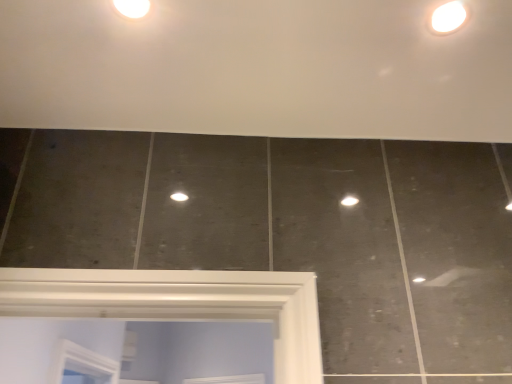
Question: Would you say white glossy droplight at upper left is outside white glossy light fixture at upper right?

Choices:
 (A) no
 (B) yes

Answer: (B)

Question: Considering the relative sizes of white glossy droplight at upper left and white glossy light fixture at upper right in the image provided, is white glossy droplight at upper left shorter than white glossy light fixture at upper right?

Choices:
 (A) yes
 (B) no

Answer: (A)

Question: Considering the relative sizes of white glossy droplight at upper left and white glossy light fixture at upper right in the image provided, is white glossy droplight at upper left taller than white glossy light fixture at upper right?

Choices:
 (A) no
 (B) yes

Answer: (A)

Question: From a real-world perspective, is white glossy droplight at upper left below white glossy light fixture at upper right?

Choices:
 (A) yes
 (B) no

Answer: (A)

Question: Is white glossy droplight at upper left bigger than white glossy light fixture at upper right?

Choices:
 (A) yes
 (B) no

Answer: (B)

Question: From the image's perspective, does white glossy droplight at upper left appear lower than white glossy light fixture at upper right?

Choices:
 (A) no
 (B) yes

Answer: (A)

Question: Is white glossy droplight at upper left at the back of white glossy light fixture at upper right?

Choices:
 (A) yes
 (B) no

Answer: (B)

Question: From the image's perspective, would you say white glossy light fixture at upper right is positioned over white glossy droplight at upper left?

Choices:
 (A) yes
 (B) no

Answer: (B)

Question: From the image's perspective, is white glossy light fixture at upper right under white glossy droplight at upper left?

Choices:
 (A) yes
 (B) no

Answer: (A)

Question: From a real-world perspective, does white glossy light fixture at upper right stand above white glossy droplight at upper left?

Choices:
 (A) yes
 (B) no

Answer: (A)

Question: Could you tell me if white glossy light fixture at upper right is facing white glossy droplight at upper left?

Choices:
 (A) yes
 (B) no

Answer: (B)

Question: Does white glossy light fixture at upper right have a greater height compared to white glossy droplight at upper left?

Choices:
 (A) no
 (B) yes

Answer: (B)

Question: Is point (436, 8) closer or farther from the camera than point (117, 0)?

Choices:
 (A) farther
 (B) closer

Answer: (A)